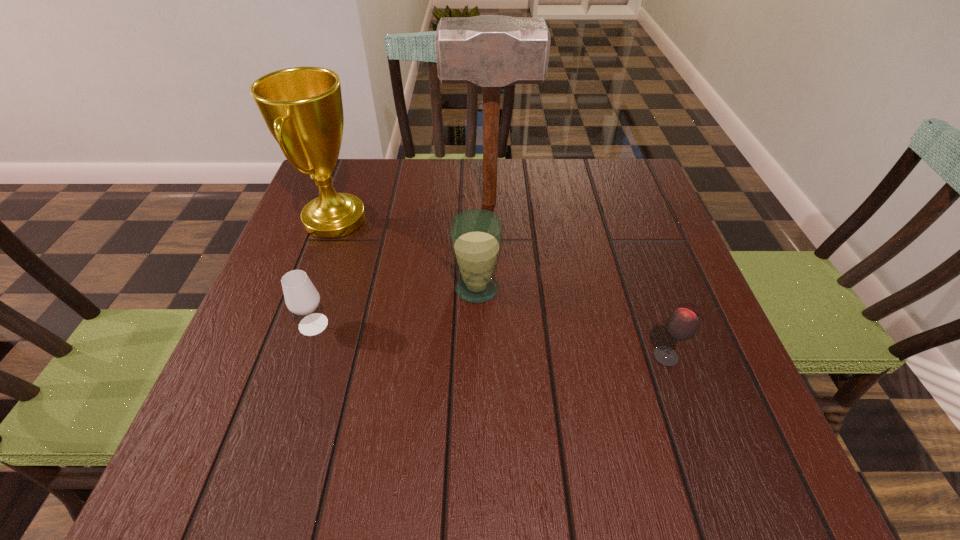
Identify the location of object at the far left corner. Image resolution: width=960 pixels, height=540 pixels. (302, 107).

I want to click on free location at the far edge, so click(x=534, y=211).

The image size is (960, 540). In the image, there is a desktop. In order to click on blank space at the near edge in this screenshot , I will do `click(472, 435)`.

The image size is (960, 540). In order to click on vacant space at the left edge of the desktop in this screenshot , I will do `click(331, 328)`.

This screenshot has height=540, width=960. What are the coordinates of `vacant area at the right edge of the desktop` in the screenshot? It's located at (734, 375).

Where is `free space at the far left corner of the desktop`? This screenshot has height=540, width=960. free space at the far left corner of the desktop is located at coordinates (373, 180).

You are a GUI agent. You are given a task and a screenshot of the screen. Output one action in this format:
    pyautogui.click(x=<x>, y=<y>)
    Task: Click on the blank space at the far right corner
    
    Given the screenshot: What is the action you would take?
    pyautogui.click(x=648, y=200)

Locate an element on the screen. The height and width of the screenshot is (540, 960). empty space that is in between the nearest object and the farthest glass is located at coordinates (571, 323).

This screenshot has width=960, height=540. I want to click on empty location between the rightmost object and the second nearest object, so click(x=490, y=341).

Locate an element on the screen. The image size is (960, 540). free space between the mallet and the rightmost object is located at coordinates (578, 280).